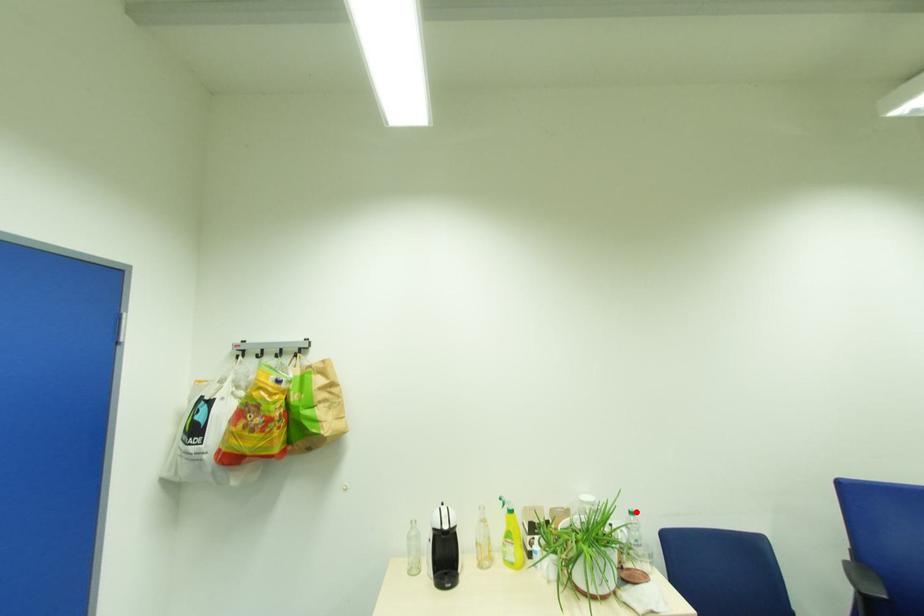
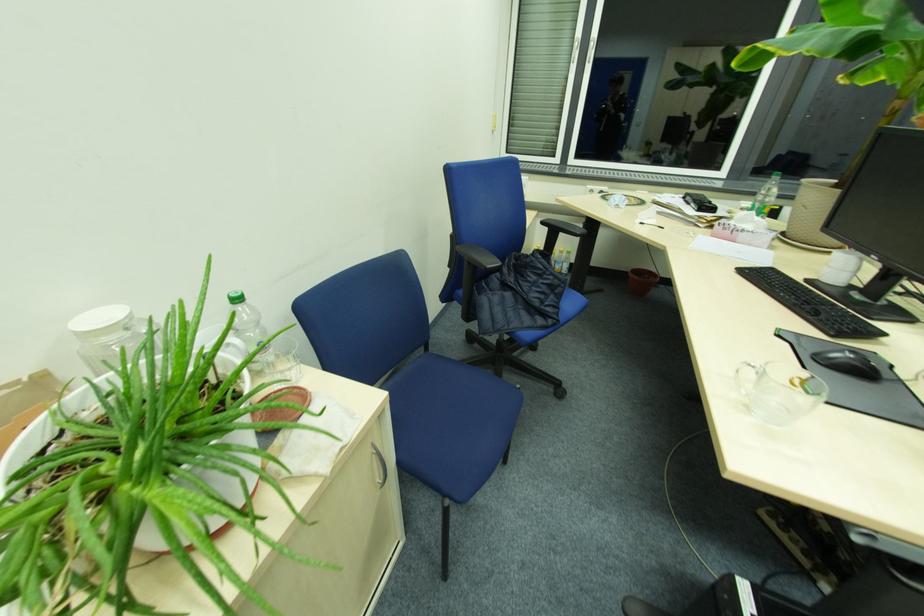
Where in the second image is the point corresponding to the highlighted location from the first image?

(237, 298)